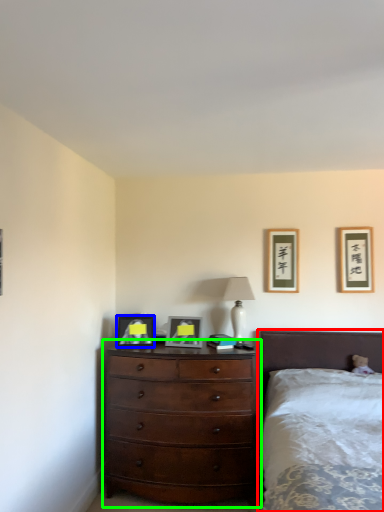
Question: Based on their relative distances, which object is nearer to bed (highlighted by a red box)? Choose from picture frame (highlighted by a blue box) and chest of drawers (highlighted by a green box).

Choices:
 (A) picture frame
 (B) chest of drawers

Answer: (B)